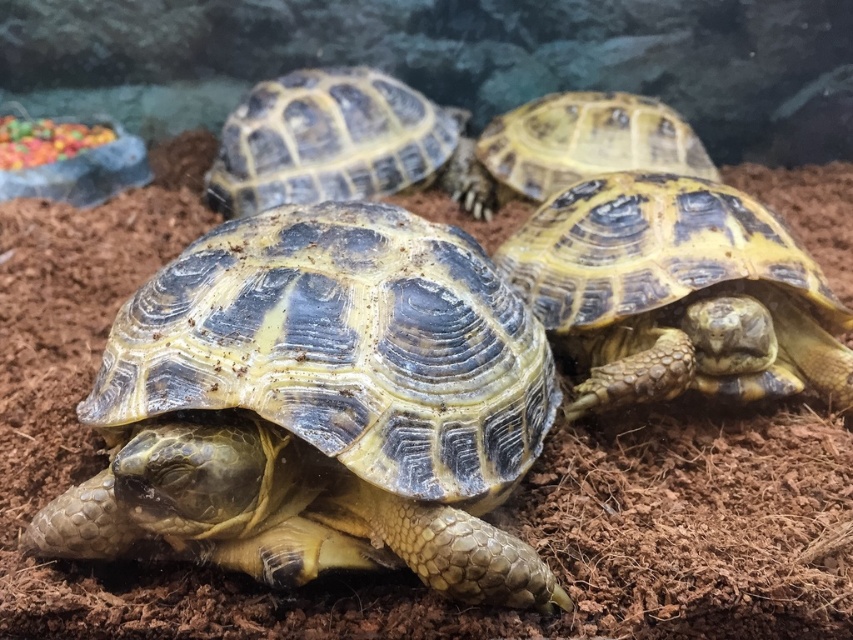
Who is more forward, (314, 330) or (474, 196)?

Point (314, 330) is more forward.

Which of these two, yellowish-brown scaly tortoise at center or yellow scaly tortoise at upper right, stands taller?

yellowish-brown scaly tortoise at center

Does point (128, 362) lie in front of point (567, 179)?

Yes, point (128, 362) is in front of point (567, 179).

Find the location of `yellowish-brown scaly tortoise at center`. yellowish-brown scaly tortoise at center is located at coordinates (318, 406).

Who is shorter, yellowish-brown scaly tortoise at center or yellowish-brown scaly shell at center?

Standing shorter between the two is yellowish-brown scaly shell at center.

Does point (381, 364) come farther from viewer compared to point (286, 108)?

That is False.

The height and width of the screenshot is (640, 853). I want to click on yellowish-brown scaly tortoise at center, so click(318, 406).

Which is behind, point (428, 112) or point (527, 147)?

The point (428, 112) is more distant.

Locate an element on the screen. yellowish-brown scaly shell at center is located at coordinates (334, 141).